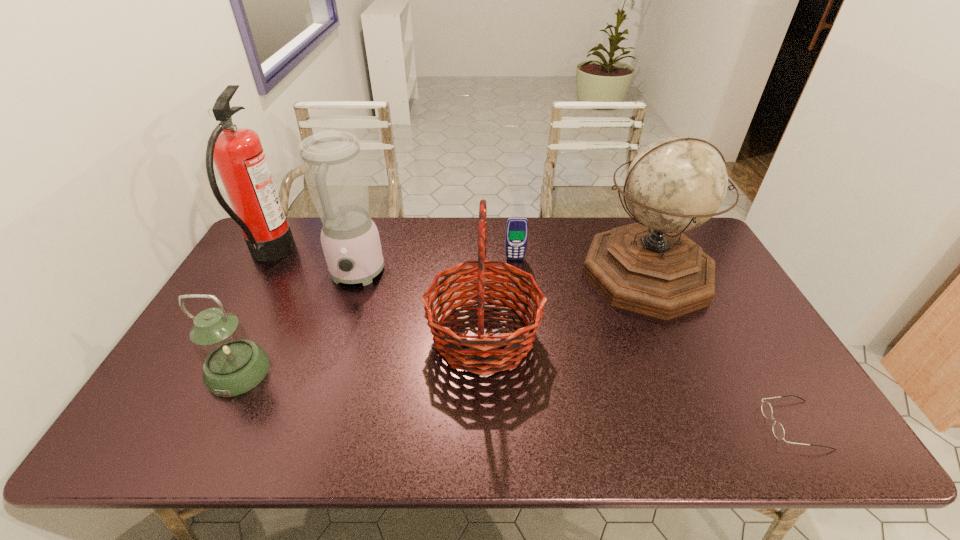
At what (x,y) coordinates should I click in order to perform the action: click on object situated at the near edge. Please return your answer as a coordinate pair (x, y). Image resolution: width=960 pixels, height=540 pixels. Looking at the image, I should click on (778, 430).

Locate an element on the screen. fire extinguisher that is at the left edge is located at coordinates (237, 153).

At what (x,y) coordinates should I click in order to perform the action: click on lantern positioned at the left edge. Please return your answer as a coordinate pair (x, y). The width and height of the screenshot is (960, 540). Looking at the image, I should click on click(x=233, y=364).

The image size is (960, 540). Identify the location of globe that is at the right edge. (675, 184).

The width and height of the screenshot is (960, 540). I want to click on spectacles positioned at the right edge, so click(x=778, y=430).

This screenshot has height=540, width=960. I want to click on object that is at the far left corner, so click(237, 153).

Locate an element on the screen. This screenshot has width=960, height=540. object that is at the far right corner is located at coordinates pos(675,184).

Locate an element on the screen. object that is at the near right corner is located at coordinates (778, 430).

In the image, there is a desktop. In order to click on vacant region at the far edge in this screenshot , I will do `click(453, 246)`.

Identify the location of free space at the near edge. The width and height of the screenshot is (960, 540). (473, 446).